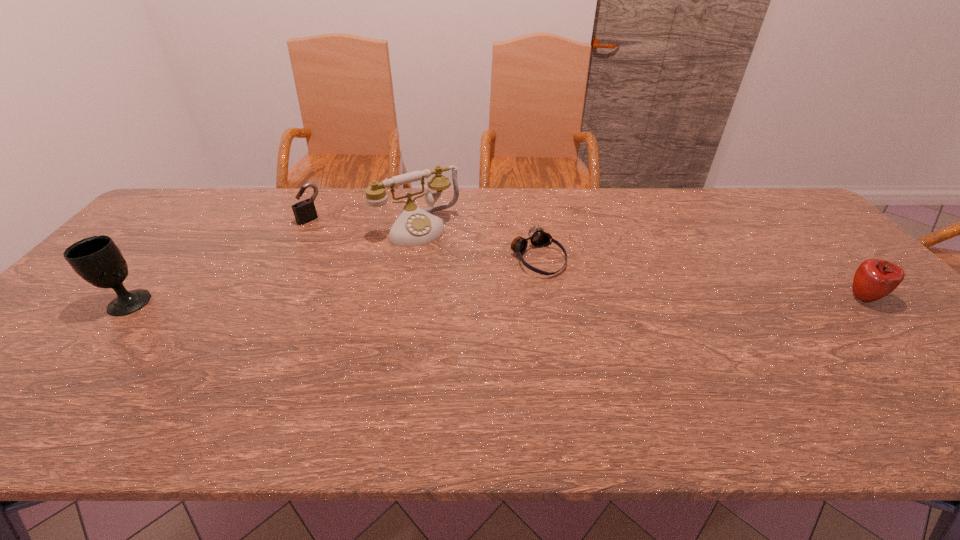
Where is `vacant space positioned 0.320m on the dial of the telephone`? This screenshot has width=960, height=540. vacant space positioned 0.320m on the dial of the telephone is located at coordinates (489, 312).

Image resolution: width=960 pixels, height=540 pixels. Identify the location of free space located through the lenses of the shortest object. (613, 322).

I want to click on vacant area located 0.080m through the lenses of the shortest object, so click(576, 292).

Where is `free space located 0.300m through the lenses of the shortest object`? free space located 0.300m through the lenses of the shortest object is located at coordinates (641, 345).

Where is `free region located with the keyhole on the front of the padlock`? The image size is (960, 540). free region located with the keyhole on the front of the padlock is located at coordinates (366, 261).

Locate an element on the screen. vacant space situated with the keyhole on the front of the padlock is located at coordinates point(353,252).

Find the location of a particular element. vacant space located with the keyhole on the front of the padlock is located at coordinates (370, 264).

Where is `telephone present at the far edge`? This screenshot has width=960, height=540. telephone present at the far edge is located at coordinates (414, 226).

Find the location of a particular element. This screenshot has width=960, height=540. padlock that is at the far edge is located at coordinates (304, 211).

Where is `object situated at the left edge`? The width and height of the screenshot is (960, 540). object situated at the left edge is located at coordinates (97, 259).